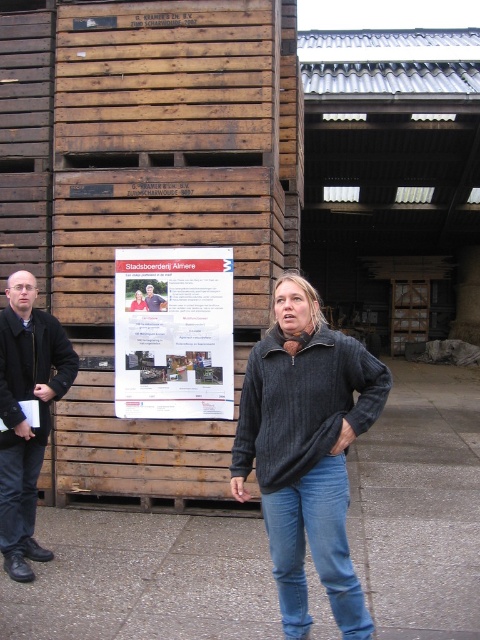
Does point (199, 403) lie behind point (1, 516)?

Yes, point (199, 403) is behind point (1, 516).

Locate an element on the screen. white paper poster at center is located at coordinates (173, 333).

Is black wool coat at left to the right of blue denim jeans at lower left from the viewer's perspective?

Indeed, black wool coat at left is positioned on the right side of blue denim jeans at lower left.

Measure the distance between black wool coat at left and blue denim jeans at lower left.

A distance of 17.22 centimeters exists between black wool coat at left and blue denim jeans at lower left.

Image resolution: width=480 pixels, height=640 pixels. What are the coordinates of `black wool coat at left` in the screenshot? It's located at (24, 416).

Find the location of a particular element. Image resolution: width=480 pixels, height=640 pixels. black wool coat at left is located at coordinates (24, 416).

Can you confirm if white paper poster at center is wider than blue denim jeans at center?

Indeed, white paper poster at center has a greater width compared to blue denim jeans at center.

Consider the image. Is white paper poster at center behind blue denim jeans at center?

Yes, white paper poster at center is further from the viewer.

The height and width of the screenshot is (640, 480). I want to click on white paper poster at center, so click(x=173, y=333).

Image resolution: width=480 pixels, height=640 pixels. What are the coordinates of `white paper poster at center` in the screenshot? It's located at (173, 333).